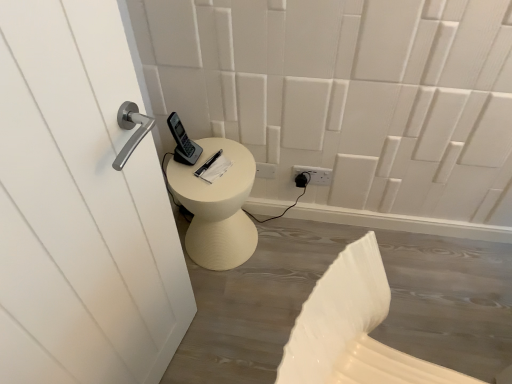
Question: Would you say white plastic electric outlet at lower center is inside or outside white plastic swivel chair at lower right?

Choices:
 (A) outside
 (B) inside

Answer: (A)

Question: Visually, is white plastic electric outlet at lower center positioned to the left or to the right of white plastic swivel chair at lower right?

Choices:
 (A) right
 (B) left

Answer: (B)

Question: In terms of height, does white plastic electric outlet at lower center look taller or shorter compared to white plastic swivel chair at lower right?

Choices:
 (A) short
 (B) tall

Answer: (A)

Question: Based on their sizes in the image, would you say white plastic swivel chair at lower right is bigger or smaller than white plastic electric outlet at lower center?

Choices:
 (A) small
 (B) big

Answer: (B)

Question: Does point coord(330,337) appear closer or farther from the camera than point coord(307,165)?

Choices:
 (A) farther
 (B) closer

Answer: (B)

Question: Looking at their shapes, would you say white plastic swivel chair at lower right is wider or thinner than white plastic electric outlet at lower center?

Choices:
 (A) wide
 (B) thin

Answer: (A)

Question: In terms of height, does white plastic swivel chair at lower right look taller or shorter compared to white plastic electric outlet at lower center?

Choices:
 (A) short
 (B) tall

Answer: (B)